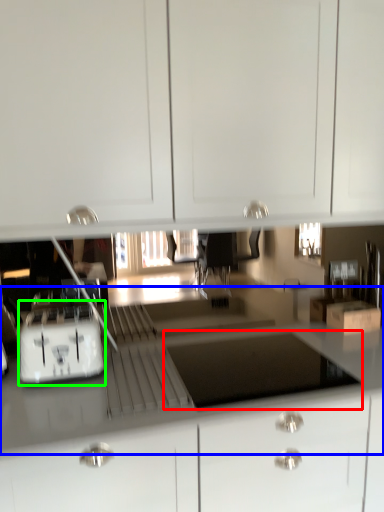
Question: Which object is the closest to the appliance (highlighted by a red box)? Choose among these: counter top (highlighted by a blue box) or home appliance (highlighted by a green box).

Choices:
 (A) counter top
 (B) home appliance

Answer: (A)